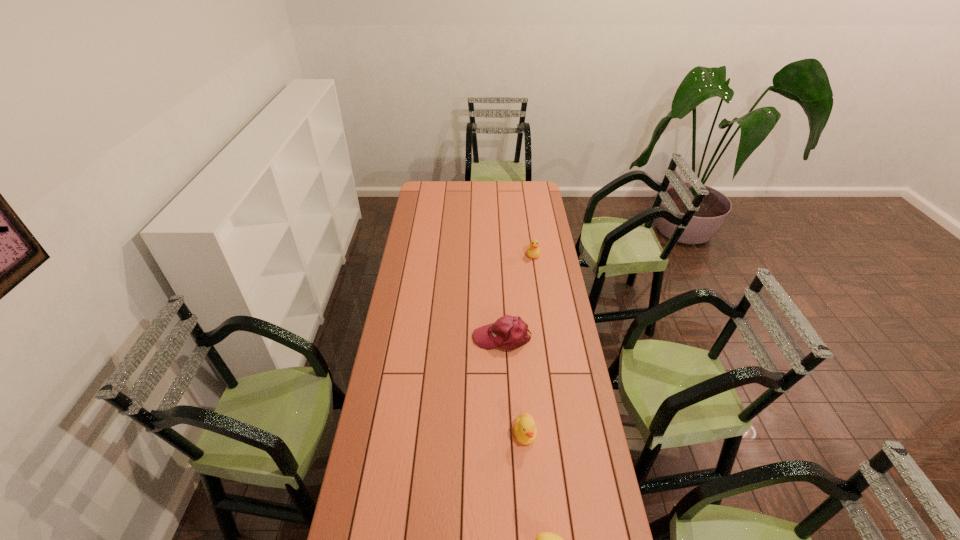
Where is `vacant point that satisfies the following two spatial constraints: 1. at the beak of the farthest duck; 2. at the front of the baseball cap with the brim`? Image resolution: width=960 pixels, height=540 pixels. vacant point that satisfies the following two spatial constraints: 1. at the beak of the farthest duck; 2. at the front of the baseball cap with the brim is located at coordinates (545, 338).